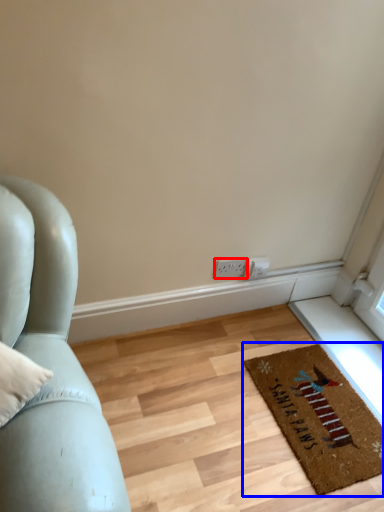
Question: Which object is closer to the camera taking this photo, electric outlet (highlighted by a red box) or mat (highlighted by a blue box)?

Choices:
 (A) electric outlet
 (B) mat

Answer: (B)